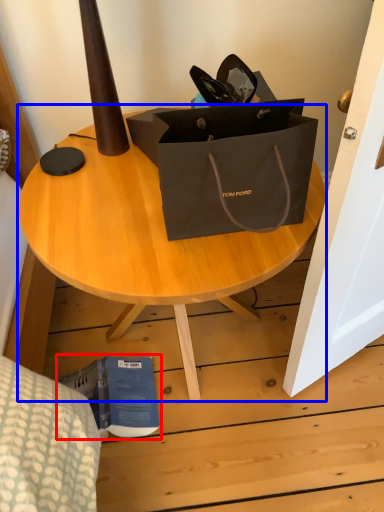
Question: Which object appears closest to the camera in this image, book (highlighted by a red box) or coffee table (highlighted by a blue box)?

Choices:
 (A) book
 (B) coffee table

Answer: (B)